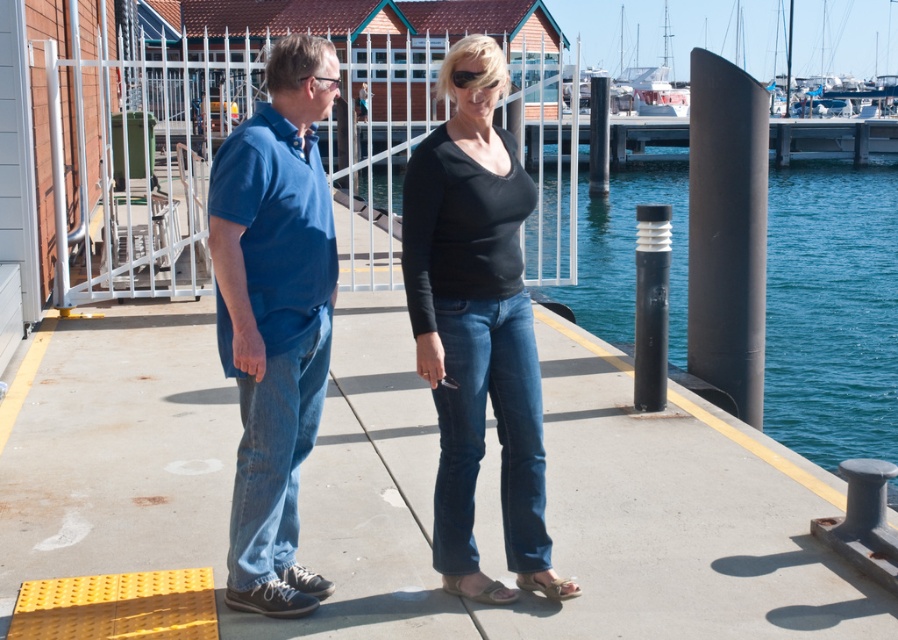
Does blue cotton shirt at center appear under brown leather sandal at lower center?

No, blue cotton shirt at center is not below brown leather sandal at lower center.

Is blue cotton shirt at center to the right of brown leather sandal at lower center from the viewer's perspective?

No, blue cotton shirt at center is not to the right of brown leather sandal at lower center.

Between point (267, 324) and point (489, 589), which one is positioned in front?

Point (267, 324)

Image resolution: width=898 pixels, height=640 pixels. In order to click on blue cotton shirt at center in this screenshot , I will do `click(275, 317)`.

Can you confirm if blue denim jeans at center is taller than blue water at center?

No, blue denim jeans at center is not taller than blue water at center.

At what (x,y) coordinates should I click in order to perform the action: click on blue denim jeans at center. Please return your answer as a coordinate pair (x, y). This screenshot has width=898, height=640. Looking at the image, I should click on (474, 310).

Is black matte shirt at center closer to camera compared to blue cotton shirt at center?

That is False.

Identify the location of black matte shirt at center. (474, 312).

This screenshot has width=898, height=640. In order to click on black matte shirt at center in this screenshot , I will do `click(474, 312)`.